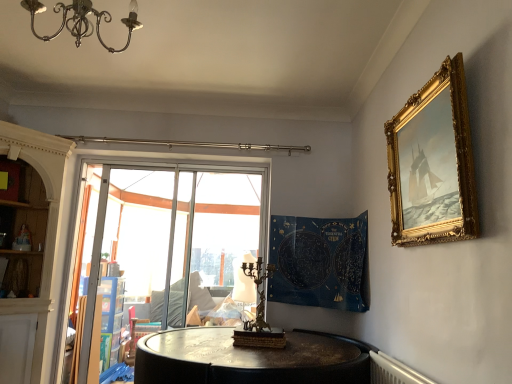
Identify the location of blue fabric tapestry at center. The image size is (512, 384). (318, 261).

The image size is (512, 384). What do you see at coordinates (259, 313) in the screenshot? I see `bronze/copper candle holder at center` at bounding box center [259, 313].

What do you see at coordinates (173, 229) in the screenshot?
I see `transparent glass window at center` at bounding box center [173, 229].

This screenshot has width=512, height=384. What are the coordinates of `gold ornate frame at upper right` in the screenshot? It's located at (433, 161).

Is point (239, 233) in front of point (300, 235)?

No, it is behind (300, 235).

How far apart are transparent plastic at center and blue fabric tapestry at center?

transparent plastic at center is 1.25 meters away from blue fabric tapestry at center.

Locate an element on the screen. This screenshot has height=384, width=512. window screen behind the blue fabric tapestry at center is located at coordinates (224, 224).

Considering the sizes of objects transparent plastic at center and blue fabric tapestry at center in the image provided, who is shorter, transparent plastic at center or blue fabric tapestry at center?

Standing shorter between the two is blue fabric tapestry at center.

From a real-world perspective, is gold ornate frame at upper right physically located above or below metallic chandelier at upper left?

In terms of real-world spatial position, gold ornate frame at upper right is below metallic chandelier at upper left.

Is gold ornate frame at upper right shorter than metallic chandelier at upper left?

No, gold ornate frame at upper right is not shorter than metallic chandelier at upper left.

Which point is more forward, (463, 72) or (131, 33)?

Point (463, 72)

Between gold ornate frame at upper right and metallic chandelier at upper left, which one appears on the right side from the viewer's perspective?

gold ornate frame at upper right.

How many degrees apart are the facing directions of metallic chandelier at upper left and transparent plastic at center?

5.8 degrees separate the facing orientations of metallic chandelier at upper left and transparent plastic at center.

From the image's perspective, is metallic chandelier at upper left located above or below transparent plastic at center?

metallic chandelier at upper left is above transparent plastic at center.

Find the location of a particular element. This screenshot has height=384, width=512. window screen below the metallic chandelier at upper left (from a real-world perspective) is located at coordinates [x=224, y=224].

Looking at the image, does metallic chandelier at upper left seem bigger or smaller compared to transparent plastic at center?

metallic chandelier at upper left is smaller than transparent plastic at center.

From their relative heights in the image, would you say transparent glass window at center is taller or shorter than bronze/copper candle holder at center?

In the image, transparent glass window at center appears to be taller than bronze/copper candle holder at center.

Considering the sizes of objects transparent glass window at center and bronze/copper candle holder at center in the image provided, who is wider, transparent glass window at center or bronze/copper candle holder at center?

bronze/copper candle holder at center.

From the image's perspective, who appears lower, transparent glass window at center or bronze/copper candle holder at center?

transparent glass window at center.

Consider the image. In the image, is transparent glass window at center on the left side or the right side of bronze/copper candle holder at center?

transparent glass window at center is to the left of bronze/copper candle holder at center.

Is metallic chandelier at upper left not close to gold ornate frame at upper right?

Yes, metallic chandelier at upper left and gold ornate frame at upper right are quite far apart.

Looking at the image, does metallic chandelier at upper left seem bigger or smaller compared to gold ornate frame at upper right?

metallic chandelier at upper left is bigger than gold ornate frame at upper right.

Is metallic chandelier at upper left not inside gold ornate frame at upper right?

Yes, metallic chandelier at upper left is located beyond the bounds of gold ornate frame at upper right.

Does metallic chandelier at upper left have a greater width compared to gold ornate frame at upper right?

Yes.

Is metallic chandelier at upper left to the left of transparent glass window at center from the viewer's perspective?

No.

In terms of height, does metallic chandelier at upper left look taller or shorter compared to transparent glass window at center?

Clearly, metallic chandelier at upper left is shorter compared to transparent glass window at center.

From a real-world perspective, is metallic chandelier at upper left on top of transparent glass window at center?

Yes.

Would you say transparent plastic at center is outside bronze/copper candle holder at center?

Yes, transparent plastic at center is located beyond the bounds of bronze/copper candle holder at center.

Can you confirm if transparent plastic at center is positioned to the right of bronze/copper candle holder at center?

Incorrect, transparent plastic at center is not on the right side of bronze/copper candle holder at center.

Who is smaller, transparent plastic at center or bronze/copper candle holder at center?

Smaller between the two is bronze/copper candle holder at center.

From the image's perspective, between transparent plastic at center and bronze/copper candle holder at center, which one is located above?

transparent plastic at center.

Identify the location of window screen lying on the left of blue fabric tapestry at center. This screenshot has height=384, width=512. (224, 224).

Locate an element on the screen. picture frame that appears below the metallic chandelier at upper left (from a real-world perspective) is located at coordinates 433,161.

From the image, which object appears to be farther from transparent plastic at center, transparent glass window at center or metallic chandelier at upper left?

Based on the image, metallic chandelier at upper left appears to be further to transparent plastic at center.

Which object lies nearer to the anchor point metallic chandelier at upper left, blue fabric tapestry at center or transparent glass window at center?

blue fabric tapestry at center lies closer to metallic chandelier at upper left than the other object.

Considering their positions, is transparent glass window at center positioned further to bronze/copper candle holder at center than metallic chandelier at upper left?

metallic chandelier at upper left is positioned further to the anchor bronze/copper candle holder at center.

When comparing their distances from bronze/copper candle holder at center, does blue fabric tapestry at center or transparent glass window at center seem closer?

blue fabric tapestry at center lies closer to bronze/copper candle holder at center than the other object.

Looking at the image, which one is located further to transparent plastic at center, blue fabric tapestry at center or transparent glass window at center?

blue fabric tapestry at center is positioned further to the anchor transparent plastic at center.

Considering their positions, is blue fabric tapestry at center positioned further to gold ornate frame at upper right than metallic chandelier at upper left?

metallic chandelier at upper left.

Based on the photo, based on their spatial positions, is transparent glass window at center or gold ornate frame at upper right further from transparent plastic at center?

gold ornate frame at upper right is positioned further to the anchor transparent plastic at center.

Considering their positions, is blue fabric tapestry at center positioned further to bronze/copper candle holder at center than metallic chandelier at upper left?

metallic chandelier at upper left is positioned further to the anchor bronze/copper candle holder at center.

Image resolution: width=512 pixels, height=384 pixels. In order to click on candle holder between metallic chandelier at upper left and transparent glass window at center from front to back in this screenshot , I will do `click(259, 313)`.

Where is `window between bronze/copper candle holder at center and transparent plastic at center in the front-back direction`? window between bronze/copper candle holder at center and transparent plastic at center in the front-back direction is located at coordinates (173, 229).

The height and width of the screenshot is (384, 512). Find the location of `candle holder positioned between gold ornate frame at upper right and transparent glass window at center from near to far`. candle holder positioned between gold ornate frame at upper right and transparent glass window at center from near to far is located at coordinates (259, 313).

The height and width of the screenshot is (384, 512). I want to click on candle holder positioned between metallic chandelier at upper left and blue fabric tapestry at center from near to far, so click(259, 313).